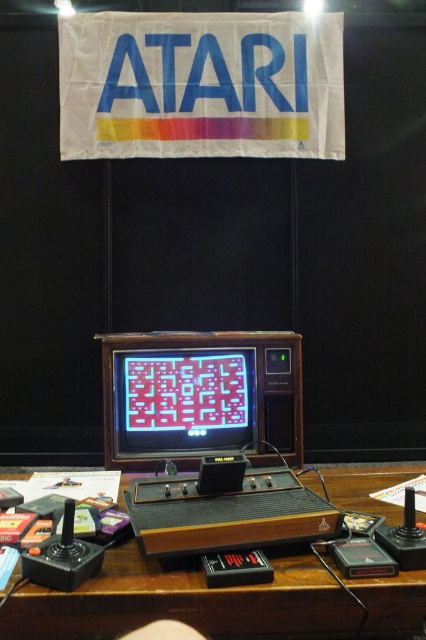
You are setting up a retro gaming display and have a brown wood table at center and a matte plastic monitor at center. Which object has a greater width?

The brown wood table at center has a greater width than the matte plastic monitor at center.

You are setting up a retro gaming display and need to place both the brown wood table at center and the matte plastic monitor at center on a shelf. The shelf has limited space. Which object should you place first to ensure both fit?

The brown wood table at center is bigger than the matte plastic monitor at center, so you should place the brown wood table at center first to ensure both fit on the shelf.

You are a game developer who wants to place a new controller on the brown wood table at center so that it faces the matte plastic monitor at center. Which direction should you place the controller to ensure it faces the monitor?

The brown wood table at center is in front of the matte plastic monitor at center, so you should place the controller facing towards the matte plastic monitor at center to ensure it faces the monitor.